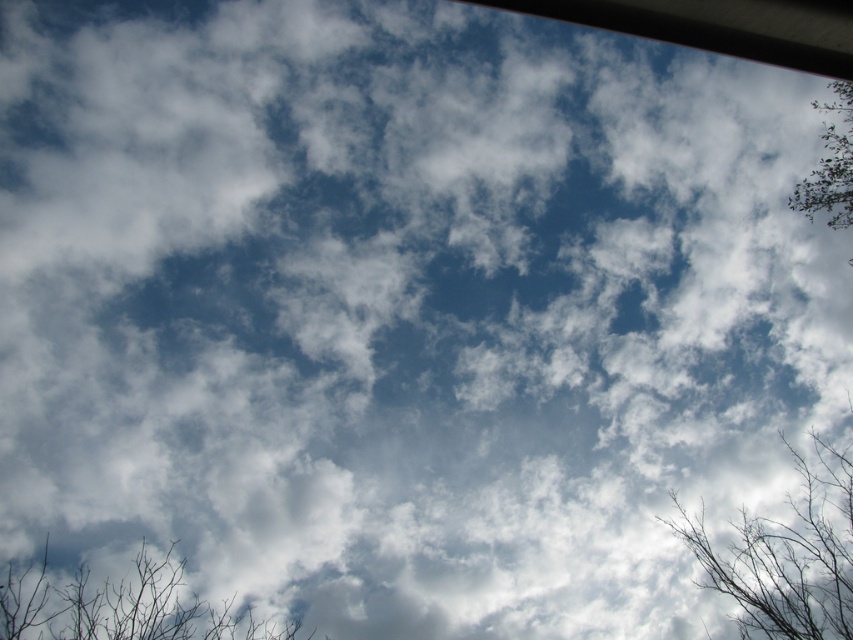
Question: Is bare branches at lower right positioned at the back of brown/dry wood tree at lower left?

Choices:
 (A) yes
 (B) no

Answer: (A)

Question: Which point is closer to the camera?

Choices:
 (A) (196, 620)
 (B) (850, 118)
 (C) (770, 540)

Answer: (A)

Question: Estimate the real-world distances between objects in this image. Which object is farther from the brown/dry wood tree at lower left?

Choices:
 (A) bare branches at lower right
 (B) green leafy tree at upper right

Answer: (B)

Question: Which point is closer to the camera?

Choices:
 (A) brown/dry wood tree at lower left
 (B) bare branches at lower right
 (C) green leafy tree at upper right

Answer: (A)

Question: From the image, what is the correct spatial relationship of brown/dry wood tree at lower left in relation to green leafy tree at upper right?

Choices:
 (A) left
 (B) right

Answer: (A)

Question: Does bare branches at lower right appear on the right side of brown/dry wood tree at lower left?

Choices:
 (A) no
 (B) yes

Answer: (B)